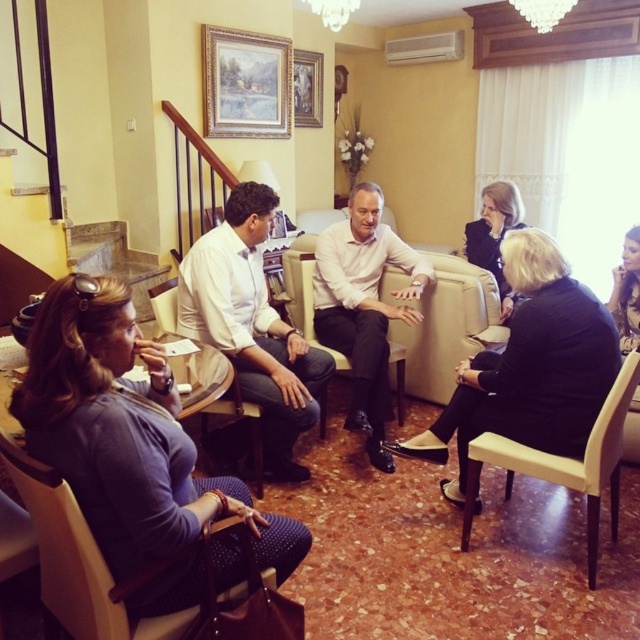
Question: Which of the following is the farthest from the observer?

Choices:
 (A) click(x=300, y=58)
 (B) click(x=618, y=324)
 (C) click(x=540, y=301)

Answer: (A)

Question: Which of the following is the closest to the observer?

Choices:
 (A) matte black chair at lower left
 (B) matte purple dress at lower left

Answer: (B)

Question: Does matte purple dress at lower left have a larger size compared to white smooth shirt at center?

Choices:
 (A) yes
 (B) no

Answer: (B)

Question: Which object is the farthest from the black leather jacket at lower right?

Choices:
 (A) black leather jacket at upper right
 (B) matte purple dress at lower left
 (C) matte beige armchair at center
 (D) smooth black dress at lower right

Answer: (B)

Question: Is black leather armchair at lower right positioned at the back of beige fabric armchair at center?

Choices:
 (A) yes
 (B) no

Answer: (B)

Question: Can you confirm if matte gold picture frame at upper center is positioned above beige fabric armchair at center?

Choices:
 (A) yes
 (B) no

Answer: (A)